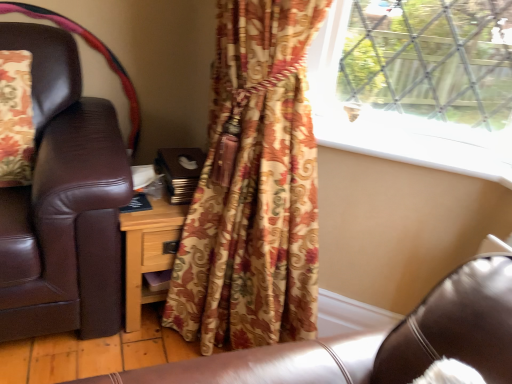
Question: Based on their sizes in the image, would you say white smooth window sill at upper center is bigger or smaller than wooden nightstand at center?

Choices:
 (A) big
 (B) small

Answer: (B)

Question: From a real-world perspective, is white smooth window sill at upper center physically located above or below wooden nightstand at center?

Choices:
 (A) above
 (B) below

Answer: (A)

Question: Which of these objects is positioned closest to the wooden nightstand at center?

Choices:
 (A) white smooth window sill at upper center
 (B) floral fabric curtain at center

Answer: (B)

Question: Which is nearer to the white smooth window sill at upper center?

Choices:
 (A) floral fabric curtain at center
 (B) wooden nightstand at center

Answer: (A)